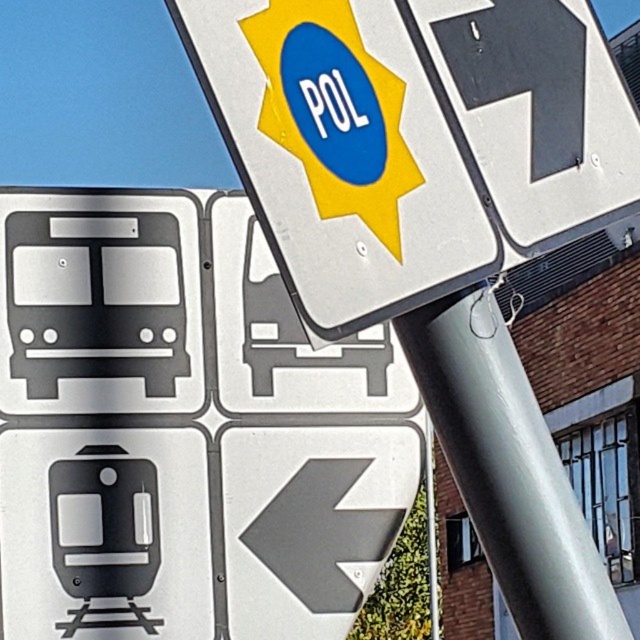
Question: Which object is the closest to the metallic silver sign at upper center?

Choices:
 (A) black matte arrow at upper right
 (B) silver metallic pole at center
 (C) metallic gray arrow at lower left

Answer: (A)

Question: Which object appears farthest from the camera in this image?

Choices:
 (A) black matte arrow at upper right
 (B) silver metallic pole at center
 (C) metallic gray arrow at lower left
 (D) metallic silver sign at upper center

Answer: (C)

Question: Which point is farther to the camera?

Choices:
 (A) silver metallic pole at center
 (B) metallic gray arrow at lower left
 (C) metallic silver sign at upper center

Answer: (B)

Question: Is metallic silver sign at upper center further to camera compared to black matte arrow at upper right?

Choices:
 (A) no
 (B) yes

Answer: (A)

Question: Is black matte arrow at upper right to the right of metallic gray arrow at lower left from the viewer's perspective?

Choices:
 (A) yes
 (B) no

Answer: (A)

Question: Can you confirm if silver metallic pole at center is smaller than black matte arrow at upper right?

Choices:
 (A) no
 (B) yes

Answer: (A)